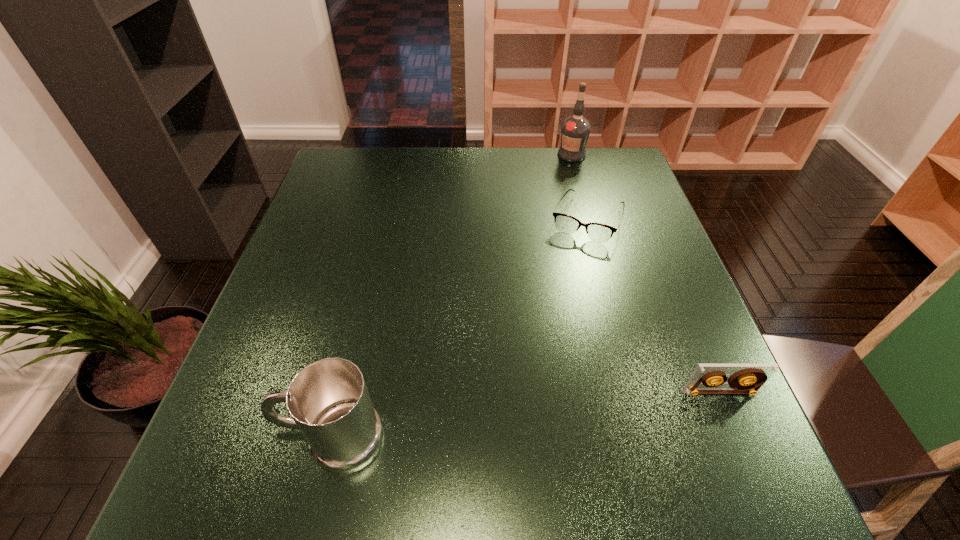
In the image, there is a desktop. At what (x,y) coordinates should I click in order to perform the action: click on vacant space at the far right corner. Please return your answer as a coordinate pair (x, y). Image resolution: width=960 pixels, height=540 pixels. Looking at the image, I should click on (620, 153).

Locate an element on the screen. free point between the second nearest object and the mug is located at coordinates (527, 416).

Where is `empty space that is in between the videotape and the shortest object`? empty space that is in between the videotape and the shortest object is located at coordinates (654, 306).

Where is `free space between the vodka and the shortest object`? The width and height of the screenshot is (960, 540). free space between the vodka and the shortest object is located at coordinates (579, 187).

Where is `vacant region between the second farthest object and the second tallest object`? This screenshot has height=540, width=960. vacant region between the second farthest object and the second tallest object is located at coordinates tap(460, 329).

Find the location of a particular element. The height and width of the screenshot is (540, 960). vacant area that lies between the tallest object and the spectacles is located at coordinates (579, 187).

At what (x,y) coordinates should I click in order to perform the action: click on free space between the tallest object and the videotape. Please return your answer as a coordinate pair (x, y). Image resolution: width=960 pixels, height=540 pixels. Looking at the image, I should click on (646, 273).

Find the location of a particular element. This screenshot has height=540, width=960. free space between the tallest object and the nearest object is located at coordinates (452, 297).

This screenshot has width=960, height=540. In order to click on unoccupied area between the tallest object and the leftmost object in this screenshot , I will do `click(452, 297)`.

Identify the location of free space between the farthest object and the third farthest object. Image resolution: width=960 pixels, height=540 pixels. (646, 273).